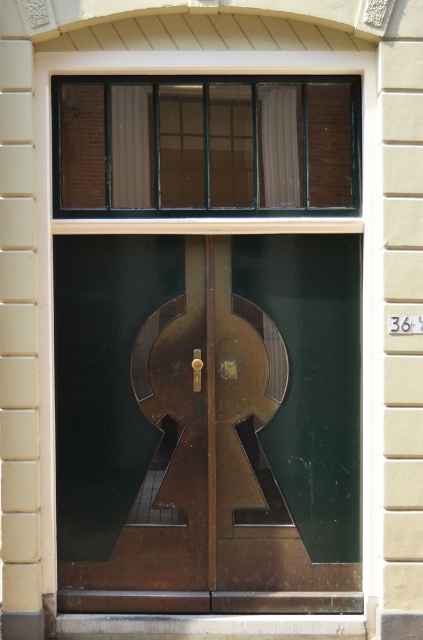
Which is in front, point (123, 241) or point (268, 113)?

Point (268, 113) is more forward.

Does bronze metallic door at center have a greater width compared to matte glass window at upper center?

Incorrect, bronze metallic door at center's width does not surpass matte glass window at upper center's.

Where is `bronze metallic door at center`? bronze metallic door at center is located at coordinates (208, 422).